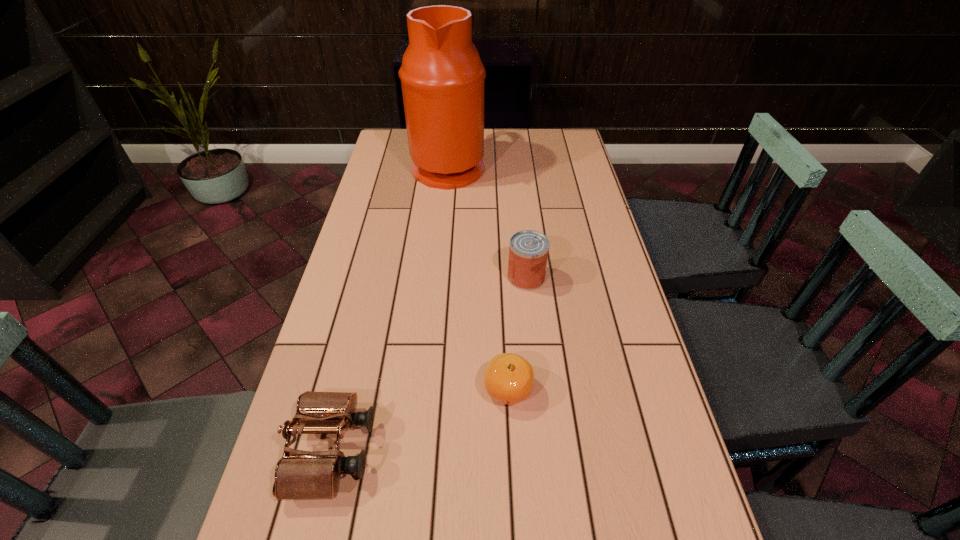
You are a GUI agent. You are given a task and a screenshot of the screen. Output one action in this format:
    pyautogui.click(x=<x>, y=<y>)
    Task: Click on the farthest object
    The width and height of the screenshot is (960, 540).
    Given the screenshot: What is the action you would take?
    pyautogui.click(x=442, y=77)

Where is `water jug`? The height and width of the screenshot is (540, 960). water jug is located at coordinates (442, 77).

Find the location of `the third shortest object`. the third shortest object is located at coordinates (528, 251).

You are a GUI agent. You are given a task and a screenshot of the screen. Output one action in this format:
    pyautogui.click(x=<x>, y=<y>)
    Task: Click on the can
    The image size is (960, 540).
    Given the screenshot: What is the action you would take?
    pyautogui.click(x=528, y=251)

Locate an element on the screen. The image size is (960, 540). binoculars is located at coordinates (299, 474).

Identify the location of clementine. (508, 378).

The width and height of the screenshot is (960, 540). I want to click on free location located 0.060m from the spout of the water jug, so click(x=501, y=166).

Where is `free region located 0.380m on the back of the third nearest object`? free region located 0.380m on the back of the third nearest object is located at coordinates (516, 189).

Where is `vacant space located through the eyepieces of the binoculars`? The width and height of the screenshot is (960, 540). vacant space located through the eyepieces of the binoculars is located at coordinates (441, 450).

Identify the location of vacant region located 0.330m on the left of the clementine. Image resolution: width=960 pixels, height=540 pixels. (334, 389).